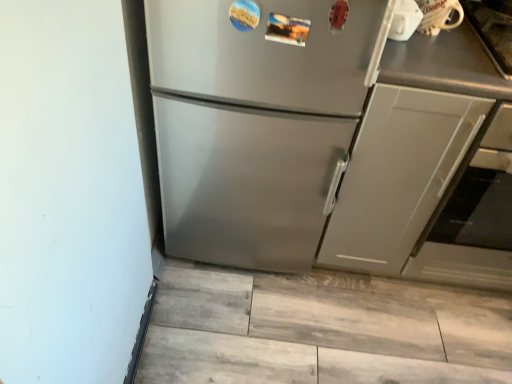
Question: From the image's perspective, is matte gray cabinet at right above or below white glossy mug at upper right?

Choices:
 (A) below
 (B) above

Answer: (A)

Question: Considering the positions of matte gray cabinet at right and white glossy mug at upper right in the image, is matte gray cabinet at right wider or thinner than white glossy mug at upper right?

Choices:
 (A) thin
 (B) wide

Answer: (B)

Question: Estimate the real-world distances between objects in this image. Which object is farther from the satin gray oven at right?

Choices:
 (A) satin silver refrigerator at center
 (B) matte gray cabinet at right
 (C) white glossy mug at upper right

Answer: (A)

Question: Which is nearer to the white glossy mug at upper right?

Choices:
 (A) satin silver refrigerator at center
 (B) satin gray oven at right
 (C) matte gray cabinet at right

Answer: (C)